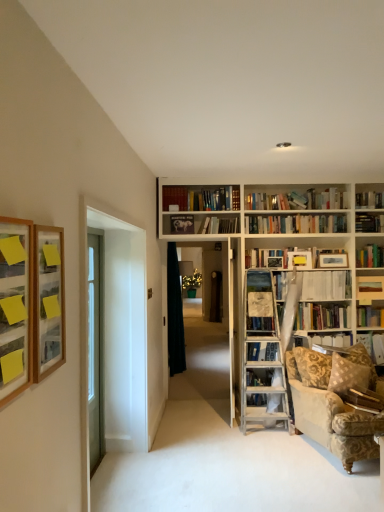
Question: Based on their sizes in the image, would you say wooden picture frame at left, the 1th picture frame positioned from the left, is bigger or smaller than hardcover book at right, which is the first book from right to left?

Choices:
 (A) small
 (B) big

Answer: (A)

Question: Is point (11, 290) positioned closer to the camera than point (365, 346)?

Choices:
 (A) closer
 (B) farther

Answer: (A)

Question: Which of these objects is positioned farthest from the clear glass door at left?

Choices:
 (A) velvet beige couch at lower right
 (B) hardcover book at upper center, the first book positioned from the back
 (C) wooden bookshelf at upper right, the 4th book from the front
 (D) hardcover book at right, acting as the third book starting from the front
 (E) wooden picture frame at left, the 1th picture frame positioned from the left

Answer: (C)

Question: Which is farther from the wooden bookshelf at center?

Choices:
 (A) clear glass door at left
 (B) velvet beige couch at lower right
 (C) hardcover book at right, the 3th book from the back
 (D) wooden picture frame at left, the 3th picture frame in the right-to-left sequence
 (E) clear glass door at left

Answer: (D)